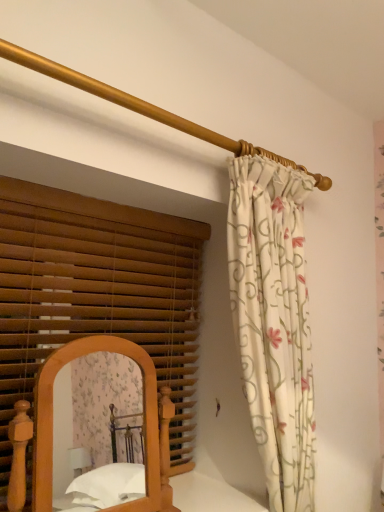
Question: Should I look upward or downward to see floral fabric curtain at upper right?

Choices:
 (A) up
 (B) down

Answer: (B)

Question: Should I look upward or downward to see wooden blinds at left?

Choices:
 (A) up
 (B) down

Answer: (B)

Question: From a real-world perspective, is floral fabric curtain at upper right physically below gold polished rod at upper center?

Choices:
 (A) no
 (B) yes

Answer: (B)

Question: From a real-world perspective, is floral fabric curtain at upper right over gold polished rod at upper center?

Choices:
 (A) no
 (B) yes

Answer: (A)

Question: Considering the relative sizes of floral fabric curtain at upper right and gold polished rod at upper center in the image provided, is floral fabric curtain at upper right smaller than gold polished rod at upper center?

Choices:
 (A) no
 (B) yes

Answer: (A)

Question: From the image's perspective, is floral fabric curtain at upper right beneath gold polished rod at upper center?

Choices:
 (A) no
 (B) yes

Answer: (B)

Question: Is floral fabric curtain at upper right thinner than gold polished rod at upper center?

Choices:
 (A) yes
 (B) no

Answer: (B)

Question: Would you say floral fabric curtain at upper right is outside gold polished rod at upper center?

Choices:
 (A) no
 (B) yes

Answer: (B)

Question: Does floral fabric curtain at upper right lie behind wooden bed at lower left?

Choices:
 (A) yes
 (B) no

Answer: (A)

Question: Is floral fabric curtain at upper right closer to the viewer compared to wooden bed at lower left?

Choices:
 (A) yes
 (B) no

Answer: (B)

Question: Can you confirm if floral fabric curtain at upper right is bigger than wooden bed at lower left?

Choices:
 (A) yes
 (B) no

Answer: (A)

Question: Does floral fabric curtain at upper right have a greater height compared to wooden bed at lower left?

Choices:
 (A) yes
 (B) no

Answer: (A)

Question: From the image's perspective, does floral fabric curtain at upper right appear lower than wooden bed at lower left?

Choices:
 (A) yes
 (B) no

Answer: (B)

Question: From a real-world perspective, is floral fabric curtain at upper right beneath wooden bed at lower left?

Choices:
 (A) yes
 (B) no

Answer: (B)

Question: Is gold polished rod at upper center oriented towards wooden bed at lower left?

Choices:
 (A) yes
 (B) no

Answer: (B)